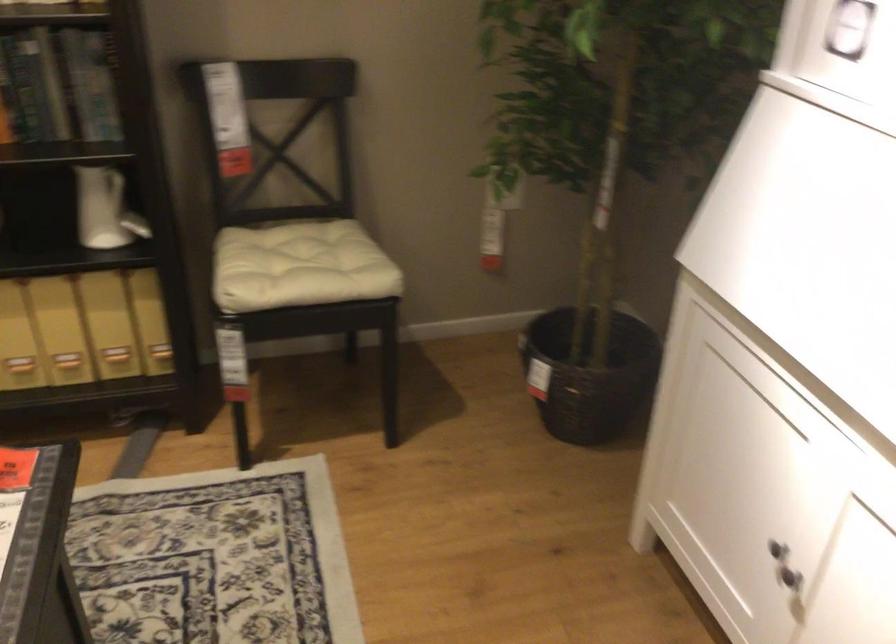
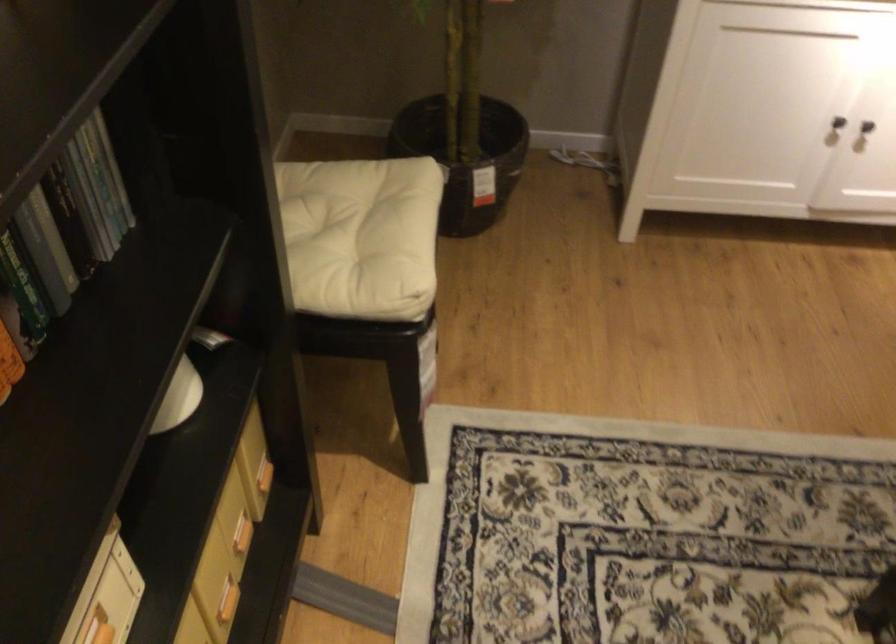
Find the pixel in the second image that matches pixel 782 569 in the first image.

(866, 126)